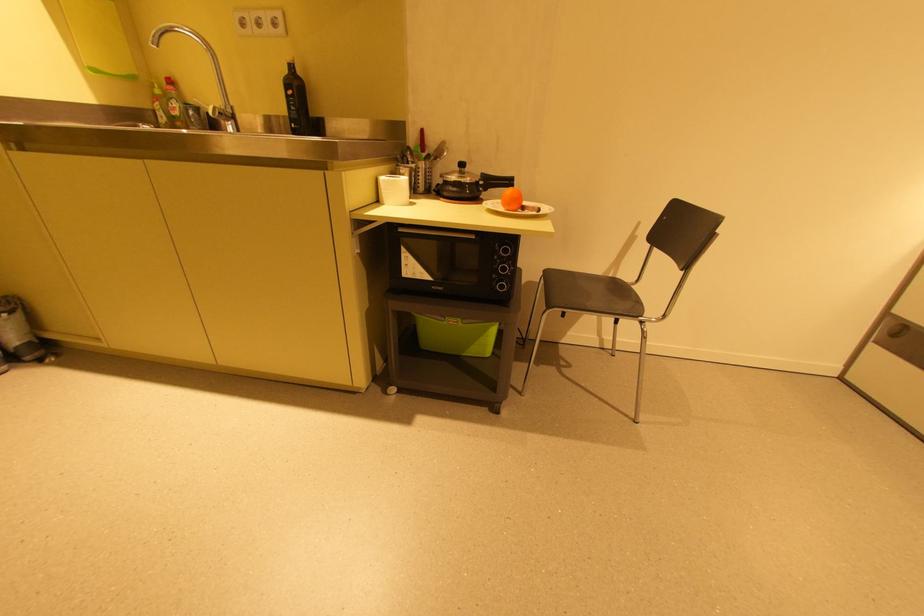
You are a GUI agent. You are given a task and a screenshot of the screen. Output one action in this format:
    pyautogui.click(x=<x>, y=<y>)
    Task: Click on the black pot handle
    
    Given the screenshot: What is the action you would take?
    pyautogui.click(x=493, y=180)